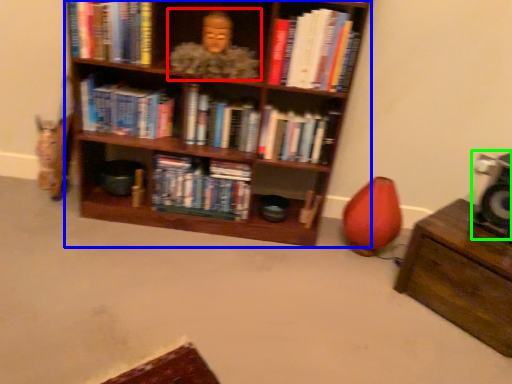
Question: Which object is positioned closest to person (highlighted by a red box)? Select from shelf (highlighted by a blue box) and speaker (highlighted by a green box).

Choices:
 (A) shelf
 (B) speaker

Answer: (A)